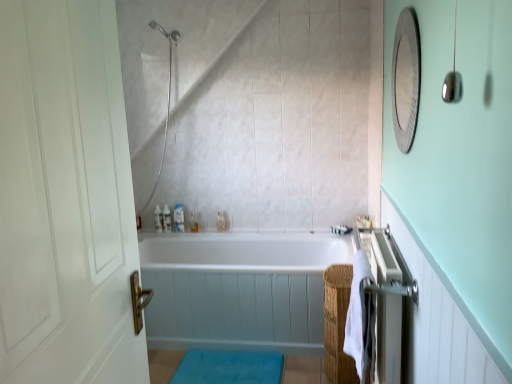
Question: From a real-world perspective, relative to silver textured mirror at upper right, is white glossy bottle at upper center, placed as the 3th toiletry when sorted from left to right, vertically above or below?

Choices:
 (A) above
 (B) below

Answer: (B)

Question: In the image, is white glossy bottle at upper center, which ranks as the 2th toiletry in right-to-left order, on the left side or the right side of silver textured mirror at upper right?

Choices:
 (A) left
 (B) right

Answer: (A)

Question: Considering the real-world distances, which object is closest to the translucent plastic bottles at upper center, marked as the 3th toiletry in a right-to-left arrangement?

Choices:
 (A) silver metallic towel rack at right
 (B) white plastic toiletries at center, arranged as the first toiletry when viewed from the left
 (C) silver textured mirror at upper right
 (D) white glossy bathtub at center
 (E) translucent plastic bottle at upper center, the fourth toiletry viewed from the left

Answer: (B)

Question: Which of these objects is positioned closest to the blue plush bath mat at lower center?

Choices:
 (A) translucent plastic bottles at upper center, positioned as the 2th toiletry in left-to-right order
 (B) white glossy bathtub at center
 (C) silver metallic towel rack at right
 (D) white soft towel at right
 (E) white plastic toiletries at center, arranged as the 4th toiletry when viewed from the right

Answer: (B)